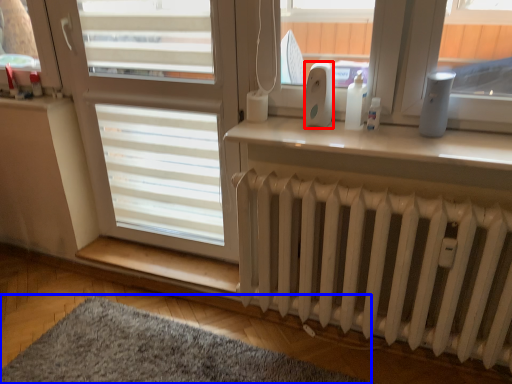
Question: Which object is closer to the camera taking this photo, appliance (highlighted by a red box) or mat (highlighted by a blue box)?

Choices:
 (A) appliance
 (B) mat

Answer: (B)